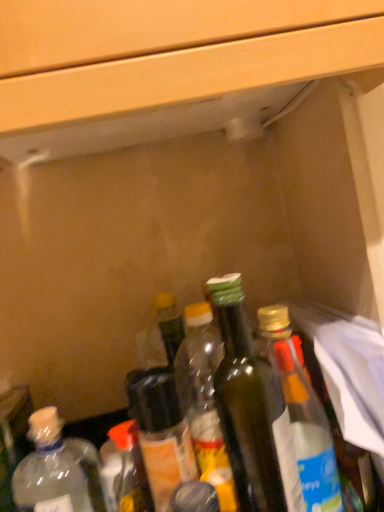
I want to click on translucent plastic bottle at center, placed as the 3th bottle when sorted from left to right, so click(x=162, y=434).

The image size is (384, 512). Describe the element at coordinates (162, 434) in the screenshot. I see `translucent plastic bottle at center, placed as the 3th bottle when sorted from left to right` at that location.

What do you see at coordinates (252, 411) in the screenshot?
I see `green glass bottle at center, which is the 2th bottle in right-to-left order` at bounding box center [252, 411].

In order to face green glass bottle at center, which is the 2th bottle in right-to-left order, should I rotate leftwards or rightwards?

Turn right by 6.866 degrees to look at green glass bottle at center, which is the 2th bottle in right-to-left order.

Identify the location of translucent plastic bottle at lower left, the 2th bottle from the left. This screenshot has width=384, height=512. (127, 469).

What is the approximate height of clear glass bottle at center, placed as the first bottle when sorted from right to left?

25.81 centimeters.

The height and width of the screenshot is (512, 384). I want to click on translucent plastic bottle at center, placed as the 3th bottle when sorted from left to right, so click(x=162, y=434).

Is translucent plastic bottle at lower left, the 2th bottle from the left, in front of or behind translucent plastic bottle at center, placed as the 3th bottle when sorted from left to right, in the image?

Clearly, translucent plastic bottle at lower left, the 2th bottle from the left, is in front of translucent plastic bottle at center, placed as the 3th bottle when sorted from left to right.

Which of these two, translucent plastic bottle at lower left, arranged as the 5th bottle when viewed from the right, or translucent plastic bottle at center, placed as the 3th bottle when sorted from left to right, stands shorter?

Standing shorter between the two is translucent plastic bottle at lower left, arranged as the 5th bottle when viewed from the right.

From the image's perspective, would you say translucent plastic bottle at lower left, the 2th bottle from the left, is shown under translucent plastic bottle at center, the fourth bottle positioned from the right?

Yes.

Is translucent plastic bottle at lower left, arranged as the 5th bottle when viewed from the right, not within translucent plastic bottle at center, placed as the 3th bottle when sorted from left to right?

Yes, translucent plastic bottle at lower left, arranged as the 5th bottle when viewed from the right, is outside of translucent plastic bottle at center, placed as the 3th bottle when sorted from left to right.

Do you think translucent plastic bottle at lower left, the 2th bottle from the left, is within clear glass bottle at center, the sixth bottle in the left-to-right sequence, or outside of it?

translucent plastic bottle at lower left, the 2th bottle from the left, cannot be found inside clear glass bottle at center, the sixth bottle in the left-to-right sequence.

In the image, is translucent plastic bottle at lower left, arranged as the 5th bottle when viewed from the right, positioned in front of or behind clear glass bottle at center, the sixth bottle in the left-to-right sequence?

Clearly, translucent plastic bottle at lower left, arranged as the 5th bottle when viewed from the right, is behind clear glass bottle at center, the sixth bottle in the left-to-right sequence.

From the image's perspective, is translucent plastic bottle at lower left, arranged as the 5th bottle when viewed from the right, below clear glass bottle at center, placed as the first bottle when sorted from right to left?

Yes.

Is translucent plastic bottle at lower left, arranged as the 5th bottle when viewed from the right, facing away from clear glass bottle at center, the sixth bottle in the left-to-right sequence?

No, translucent plastic bottle at lower left, arranged as the 5th bottle when viewed from the right, is not facing away from clear glass bottle at center, the sixth bottle in the left-to-right sequence.

Is the depth of green glass bottle at center, which is the fifth bottle in left-to-right order, greater than that of clear plastic bottle at lower left, the 6th bottle in the right-to-left sequence?

No, it is in front of clear plastic bottle at lower left, the 6th bottle in the right-to-left sequence.

From the green glass bottle at center, which is the 2th bottle in right-to-left order, count the 4th bottle to the left and point to it. Please provide its 2D coordinates.

[(57, 470)]

Considering the relative sizes of green glass bottle at center, which is the 2th bottle in right-to-left order, and clear plastic bottle at lower left, the 6th bottle in the right-to-left sequence, in the image provided, is green glass bottle at center, which is the 2th bottle in right-to-left order, taller than clear plastic bottle at lower left, the 6th bottle in the right-to-left sequence,?

Correct, green glass bottle at center, which is the 2th bottle in right-to-left order, is much taller as clear plastic bottle at lower left, the 6th bottle in the right-to-left sequence.

Is clear glass bottle at center, the sixth bottle in the left-to-right sequence, bigger or smaller than translucent plastic bottle at center, placed as the 3th bottle when sorted from left to right?

clear glass bottle at center, the sixth bottle in the left-to-right sequence, is smaller than translucent plastic bottle at center, placed as the 3th bottle when sorted from left to right.

Consider the image. Relative to translucent plastic bottle at center, placed as the 3th bottle when sorted from left to right, is clear glass bottle at center, placed as the first bottle when sorted from right to left, in front or behind?

clear glass bottle at center, placed as the first bottle when sorted from right to left, is positioned closer to the viewer than translucent plastic bottle at center, placed as the 3th bottle when sorted from left to right.

Does point (317, 442) appear closer or farther from the camera than point (144, 423)?

Point (317, 442) appears to be closer to the viewer than point (144, 423).

Is clear plastic bottle at lower left, the 6th bottle in the right-to-left sequence, completely or partially outside of translucent plastic bottle at center, the fourth bottle positioned from the right?

clear plastic bottle at lower left, the 6th bottle in the right-to-left sequence, is positioned outside translucent plastic bottle at center, the fourth bottle positioned from the right.

Is clear plastic bottle at lower left, the 6th bottle in the right-to-left sequence, not near translucent plastic bottle at center, the fourth bottle positioned from the right?

No.

Could you tell me if clear plastic bottle at lower left, the 6th bottle in the right-to-left sequence, is turned towards translucent plastic bottle at center, placed as the 3th bottle when sorted from left to right?

No, clear plastic bottle at lower left, the 6th bottle in the right-to-left sequence, is not facing towards translucent plastic bottle at center, placed as the 3th bottle when sorted from left to right.

From a real-world perspective, is clear plastic bottle at lower left, the 6th bottle in the right-to-left sequence, over translucent plastic bottle at center, placed as the 3th bottle when sorted from left to right?

No, from a real-world perspective, clear plastic bottle at lower left, the 6th bottle in the right-to-left sequence, is not above translucent plastic bottle at center, placed as the 3th bottle when sorted from left to right.

Considering the sizes of objects clear plastic bottle at lower left, the 6th bottle in the right-to-left sequence, and green glass bottle at center, which is the 2th bottle in right-to-left order, in the image provided, who is shorter, clear plastic bottle at lower left, the 6th bottle in the right-to-left sequence, or green glass bottle at center, which is the 2th bottle in right-to-left order,?

clear plastic bottle at lower left, the 6th bottle in the right-to-left sequence.

Is point (59, 476) positioned in front of point (285, 490)?

No, (59, 476) is further to viewer.

Between clear plastic bottle at lower left, the 6th bottle in the right-to-left sequence, and green glass bottle at center, which is the 2th bottle in right-to-left order, which one has smaller size?

Smaller between the two is clear plastic bottle at lower left, the 6th bottle in the right-to-left sequence.

Is clear plastic bottle at lower left, the 6th bottle in the right-to-left sequence, inside or outside of green glass bottle at center, which is the 2th bottle in right-to-left order?

The correct answer is: outside.

Considering the relative sizes of translucent plastic bottle at center, the fourth bottle positioned from the right, and green glass bottle at center, the 3th bottle when ordered from right to left, in the image provided, is translucent plastic bottle at center, the fourth bottle positioned from the right, wider than green glass bottle at center, the 3th bottle when ordered from right to left,?

Yes, translucent plastic bottle at center, the fourth bottle positioned from the right, is wider than green glass bottle at center, the 3th bottle when ordered from right to left.

Is point (158, 508) farther from camera compared to point (220, 435)?

No.

Does translucent plastic bottle at center, placed as the 3th bottle when sorted from left to right, have a lesser height compared to green glass bottle at center, which is the fourth bottle from left to right?

Correct, translucent plastic bottle at center, placed as the 3th bottle when sorted from left to right, is not as tall as green glass bottle at center, which is the fourth bottle from left to right.

What are the coordinates of `the 2nd bottle in front of the translucent plastic bottle at center, placed as the 3th bottle when sorted from left to right` in the screenshot? It's located at (127, 469).

This screenshot has height=512, width=384. Identify the location of bottle that is the 3rd one below the clear glass bottle at center, placed as the first bottle when sorted from right to left (from a real-world perspective). (127, 469).

Estimate the real-world distances between objects in this image. Which object is closer to clear glass bottle at center, placed as the first bottle when sorted from right to left, translucent plastic bottle at lower left, the 2th bottle from the left, or clear plastic bottle at lower left, acting as the 1th bottle starting from the left?

translucent plastic bottle at lower left, the 2th bottle from the left.

Looking at the image, which one is located closer to green glass bottle at center, which is the fifth bottle in left-to-right order, clear glass bottle at center, the sixth bottle in the left-to-right sequence, or translucent plastic bottle at lower left, arranged as the 5th bottle when viewed from the right?

Based on the image, clear glass bottle at center, the sixth bottle in the left-to-right sequence, appears to be nearer to green glass bottle at center, which is the fifth bottle in left-to-right order.

Based on their spatial positions, is translucent plastic bottle at center, the fourth bottle positioned from the right, or green glass bottle at center, which is the 2th bottle in right-to-left order, closer to clear glass bottle at center, the sixth bottle in the left-to-right sequence?

Based on the image, green glass bottle at center, which is the 2th bottle in right-to-left order, appears to be nearer to clear glass bottle at center, the sixth bottle in the left-to-right sequence.

In the scene shown: When comparing their distances from clear plastic bottle at lower left, the 6th bottle in the right-to-left sequence, does green glass bottle at center, the 3th bottle when ordered from right to left, or translucent plastic bottle at lower left, the 2th bottle from the left, seem further?

green glass bottle at center, the 3th bottle when ordered from right to left, is further to clear plastic bottle at lower left, the 6th bottle in the right-to-left sequence.

Looking at the image, which one is located further to clear plastic bottle at lower left, acting as the 1th bottle starting from the left, green glass bottle at center, which is the fifth bottle in left-to-right order, or clear glass bottle at center, placed as the first bottle when sorted from right to left?

clear glass bottle at center, placed as the first bottle when sorted from right to left.

When comparing their distances from clear plastic bottle at lower left, the 6th bottle in the right-to-left sequence, does clear glass bottle at center, placed as the first bottle when sorted from right to left, or green glass bottle at center, which is the fifth bottle in left-to-right order, seem further?

clear glass bottle at center, placed as the first bottle when sorted from right to left, is positioned further to the anchor clear plastic bottle at lower left, the 6th bottle in the right-to-left sequence.

Considering their positions, is translucent plastic bottle at lower left, the 2th bottle from the left, positioned closer to green glass bottle at center, the 3th bottle when ordered from right to left, than translucent plastic bottle at center, placed as the 3th bottle when sorted from left to right?

The object closer to green glass bottle at center, the 3th bottle when ordered from right to left, is translucent plastic bottle at center, placed as the 3th bottle when sorted from left to right.

When comparing their distances from clear plastic bottle at lower left, acting as the 1th bottle starting from the left, does translucent plastic bottle at lower left, arranged as the 5th bottle when viewed from the right, or green glass bottle at center, the 3th bottle when ordered from right to left, seem closer?

The object closer to clear plastic bottle at lower left, acting as the 1th bottle starting from the left, is translucent plastic bottle at lower left, arranged as the 5th bottle when viewed from the right.

Image resolution: width=384 pixels, height=512 pixels. Find the location of `bottle between translucent plastic bottle at center, placed as the 3th bottle when sorted from left to right, and green glass bottle at center, which is the fifth bottle in left-to-right order, from left to right`. bottle between translucent plastic bottle at center, placed as the 3th bottle when sorted from left to right, and green glass bottle at center, which is the fifth bottle in left-to-right order, from left to right is located at coordinates (204, 399).

This screenshot has width=384, height=512. Find the location of `bottle between green glass bottle at center, which is the fourth bottle from left to right, and clear glass bottle at center, placed as the first bottle when sorted from right to left, in the horizontal direction`. bottle between green glass bottle at center, which is the fourth bottle from left to right, and clear glass bottle at center, placed as the first bottle when sorted from right to left, in the horizontal direction is located at coordinates (252, 411).

Locate an element on the screen. bottle between clear plastic bottle at lower left, acting as the 1th bottle starting from the left, and translucent plastic bottle at center, placed as the 3th bottle when sorted from left to right, in the horizontal direction is located at coordinates (127, 469).

Where is `bottle between translucent plastic bottle at lower left, arranged as the 5th bottle when viewed from the right, and green glass bottle at center, which is the fourth bottle from left to right`? This screenshot has width=384, height=512. bottle between translucent plastic bottle at lower left, arranged as the 5th bottle when viewed from the right, and green glass bottle at center, which is the fourth bottle from left to right is located at coordinates (162, 434).